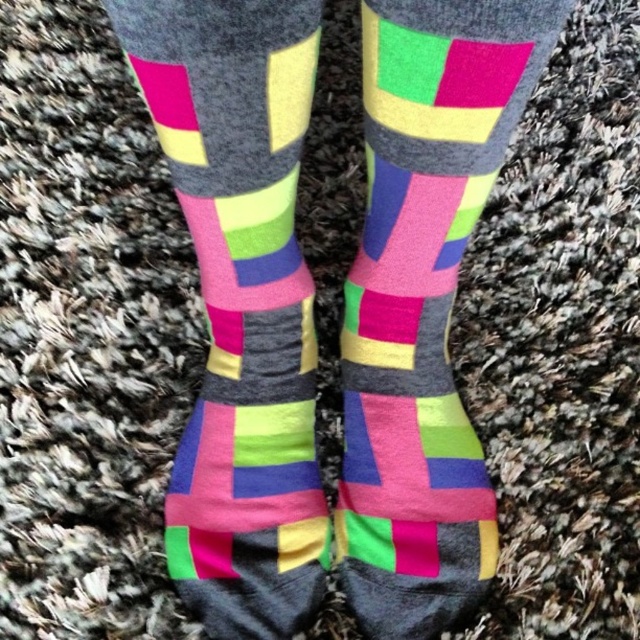
Question: Does matte cotton socks at center appear on the right side of matte multicolored socks at center?

Choices:
 (A) yes
 (B) no

Answer: (B)

Question: Is matte cotton socks at center bigger than matte multicolored socks at center?

Choices:
 (A) no
 (B) yes

Answer: (B)

Question: Which object is closer to the camera taking this photo?

Choices:
 (A) matte multicolored socks at center
 (B) matte cotton socks at center

Answer: (B)

Question: Does matte cotton socks at center have a lesser width compared to matte multicolored socks at center?

Choices:
 (A) no
 (B) yes

Answer: (B)

Question: Which point appears closest to the camera in this image?

Choices:
 (A) (248, 396)
 (B) (525, 40)

Answer: (B)